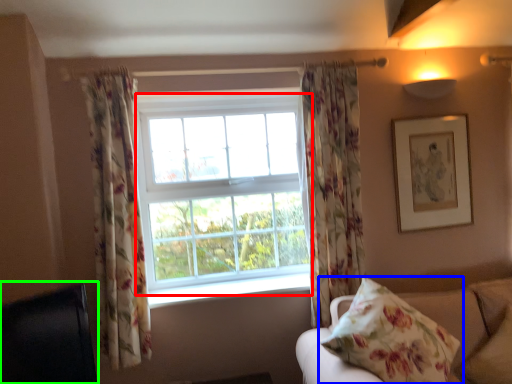
Question: Estimate the real-world distances between objects in this image. Which object is closer to bay window (highlighted by a red box), pillow (highlighted by a blue box) or furniture (highlighted by a green box)?

Choices:
 (A) pillow
 (B) furniture

Answer: (B)